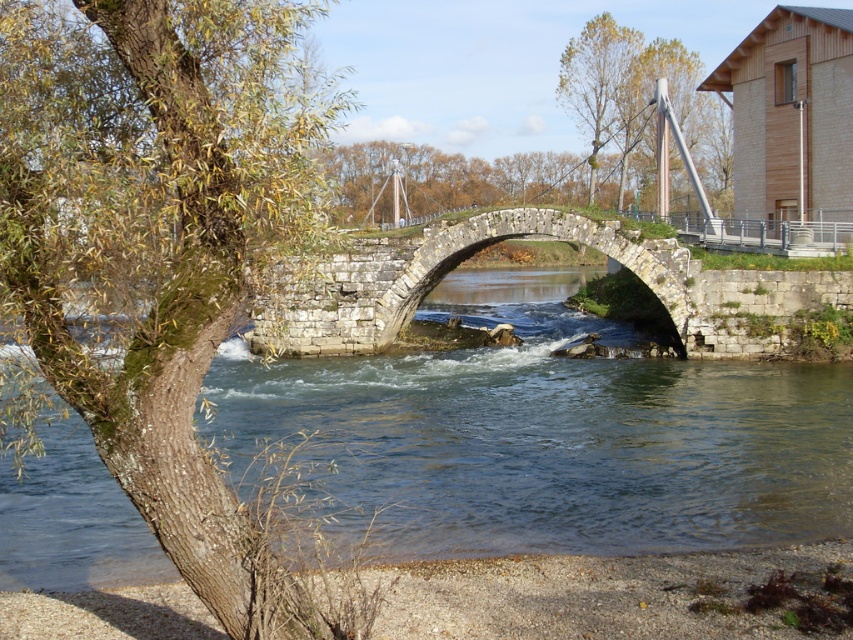
The width and height of the screenshot is (853, 640). What do you see at coordinates (676, 112) in the screenshot?
I see `metallic pole at upper right` at bounding box center [676, 112].

The height and width of the screenshot is (640, 853). Identify the location of metallic pole at upper right. click(676, 112).

Who is more distant from viewer, (x=32, y=406) or (x=351, y=282)?

The point (x=351, y=282) is behind.

Is green mossy bark tree at left taller than stone arch bridge at center?

Yes, green mossy bark tree at left is taller than stone arch bridge at center.

Is point (287, 3) farther from viewer compared to point (497, 216)?

No, it is in front of (497, 216).

What are the coordinates of `green mossy bark tree at left` in the screenshot? It's located at (160, 244).

Which is more to the left, green mossy bark tree at left or green leafy tree at upper center?

green mossy bark tree at left

Is point (228, 320) farther from viewer compared to point (631, 61)?

No, (228, 320) is in front of (631, 61).

Where is `green mossy bark tree at left`? The width and height of the screenshot is (853, 640). green mossy bark tree at left is located at coordinates (160, 244).